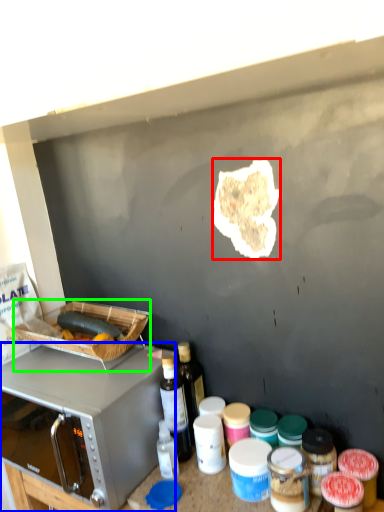
Question: Which object is the farthest from food (highlighted by a red box)? Choose among these: microwave oven (highlighted by a blue box) or appliance (highlighted by a green box).

Choices:
 (A) microwave oven
 (B) appliance

Answer: (A)